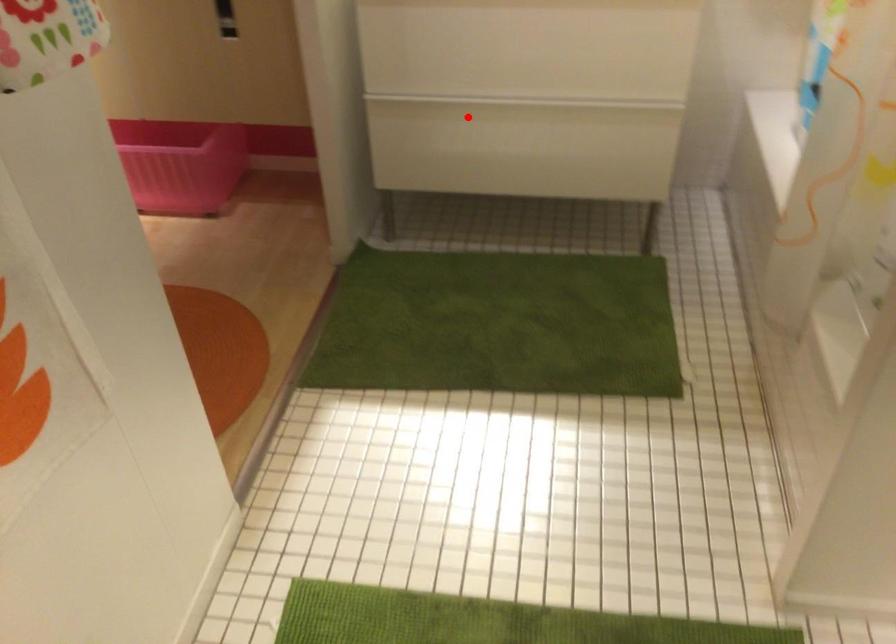
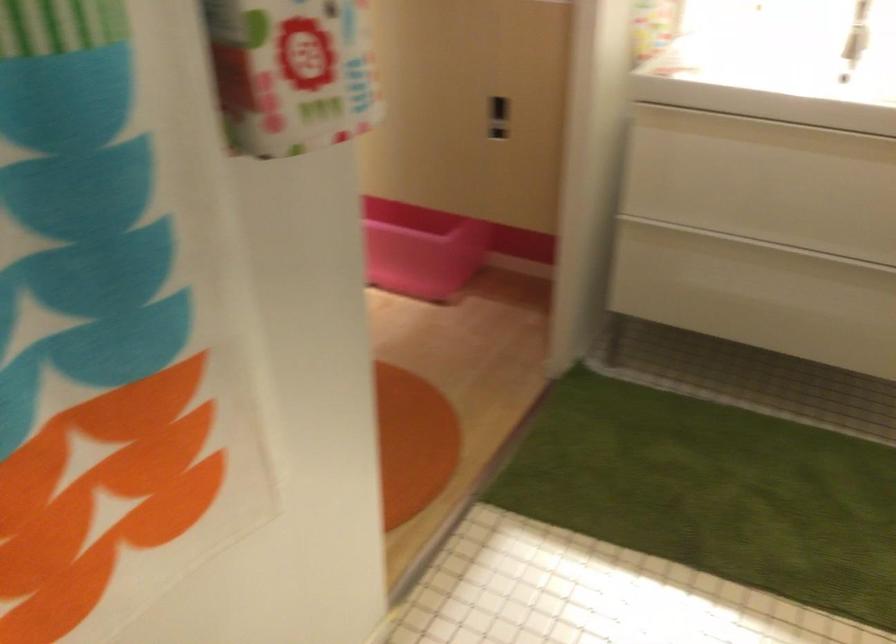
Locate, in the second image, the point that corresponds to the highlighted location in the first image.

(734, 254)